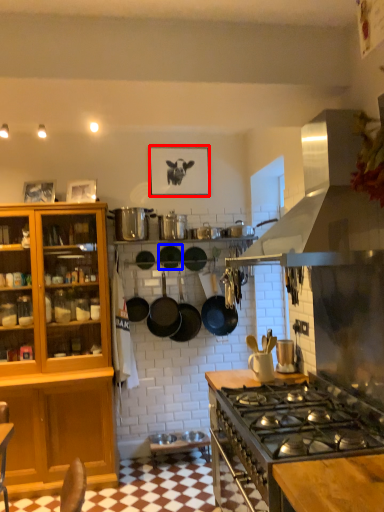
Question: Which object appears farthest to the camera in this image, picture frame (highlighted by a red box) or frying pan (highlighted by a blue box)?

Choices:
 (A) picture frame
 (B) frying pan

Answer: (A)